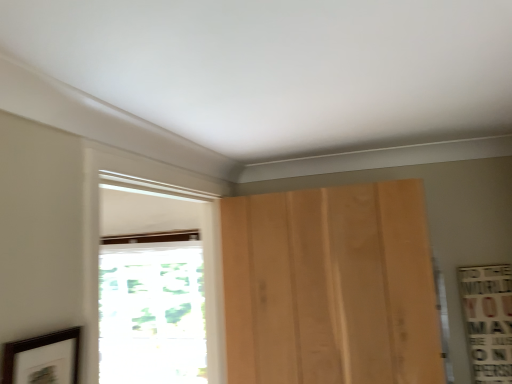
Question: Does transparent glass window at left, which appears as the second window when viewed from the front, have a larger size compared to white wood window at center, the first window from the front?

Choices:
 (A) yes
 (B) no

Answer: (A)

Question: Is transparent glass window at left, which appears as the second window when viewed from the front, outside white wood window at center, the first window from the front?

Choices:
 (A) no
 (B) yes

Answer: (B)

Question: Is white wood window at center, the first window from the front, located within transparent glass window at left, which appears as the second window when viewed from the front?

Choices:
 (A) no
 (B) yes

Answer: (A)

Question: Does transparent glass window at left, which appears as the second window when viewed from the front, have a lesser width compared to white wood window at center, placed as the 2th window when sorted from back to front?

Choices:
 (A) yes
 (B) no

Answer: (B)

Question: Is transparent glass window at left, which is counted as the 1th window, starting from the back, not close to white wood window at center, placed as the 2th window when sorted from back to front?

Choices:
 (A) yes
 (B) no

Answer: (B)

Question: From a real-world perspective, is transparent glass window at left, which is counted as the 1th window, starting from the back, positioned over white wood window at center, the first window from the front, based on gravity?

Choices:
 (A) no
 (B) yes

Answer: (A)

Question: From the image's perspective, is dark brown wooden picture frame at lower left above transparent glass window at left, which appears as the second window when viewed from the front?

Choices:
 (A) yes
 (B) no

Answer: (A)

Question: Does dark brown wooden picture frame at lower left have a lesser height compared to transparent glass window at left, which is counted as the 1th window, starting from the back?

Choices:
 (A) yes
 (B) no

Answer: (A)

Question: Is dark brown wooden picture frame at lower left turned away from transparent glass window at left, which appears as the second window when viewed from the front?

Choices:
 (A) yes
 (B) no

Answer: (B)

Question: Does dark brown wooden picture frame at lower left turn towards transparent glass window at left, which appears as the second window when viewed from the front?

Choices:
 (A) no
 (B) yes

Answer: (A)

Question: Does dark brown wooden picture frame at lower left have a larger size compared to transparent glass window at left, which is counted as the 1th window, starting from the back?

Choices:
 (A) yes
 (B) no

Answer: (B)

Question: From a real-world perspective, is dark brown wooden picture frame at lower left positioned under transparent glass window at left, which is counted as the 1th window, starting from the back, based on gravity?

Choices:
 (A) no
 (B) yes

Answer: (A)

Question: Does light brown wood door at center turn towards white wood window at center, the first window from the front?

Choices:
 (A) yes
 (B) no

Answer: (A)